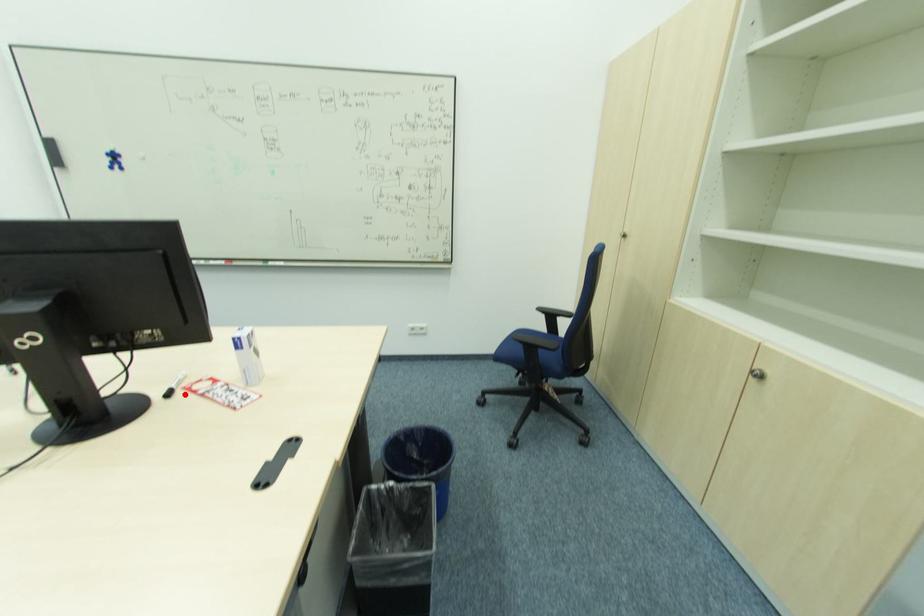
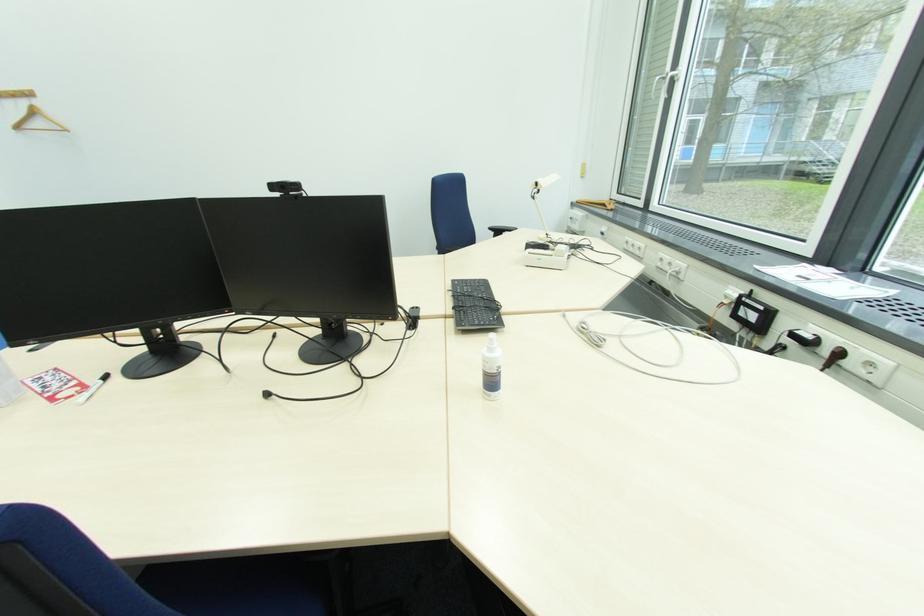
The point at the highlighted location is marked in the first image. Where is the corresponding point in the second image?

(100, 384)